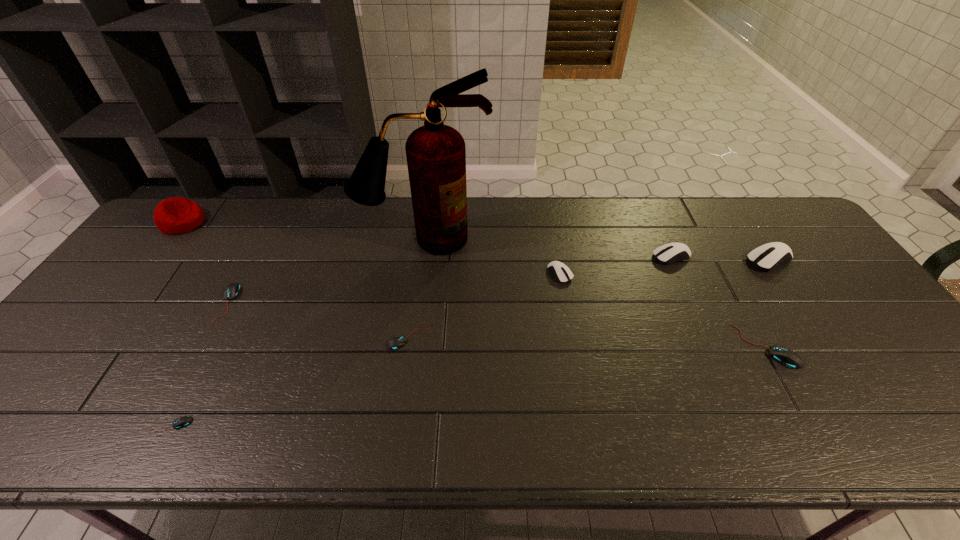
You are a GUI agent. You are given a task and a screenshot of the screen. Output one action in this format:
    pyautogui.click(x=<x>, y=<y>)
    Task: Click on the biggest black mouse
    Image resolution: width=960 pixels, height=540 pixels.
    Given the screenshot: What is the action you would take?
    pyautogui.click(x=785, y=356)

Locate an element on the screen. The width and height of the screenshot is (960, 540). the rightmost black mouse is located at coordinates [x=785, y=356].

This screenshot has height=540, width=960. Identify the location of the third shortest mouse. (232, 290).

Find the location of a particular element. The height and width of the screenshot is (540, 960). the second biggest black mouse is located at coordinates (232, 290).

In order to click on the fifth mouse from right to left in this screenshot , I will do `click(399, 340)`.

In order to click on the eighth tallest object in this screenshot , I will do `click(399, 340)`.

Where is `the nearest black mouse`? This screenshot has width=960, height=540. the nearest black mouse is located at coordinates (181, 422).

At what (x,y) coordinates should I click in order to perform the action: click on the nearest mouse. Please return your answer as a coordinate pair (x, y). Looking at the image, I should click on (181, 422).

Locate an element on the screen. The width and height of the screenshot is (960, 540). vacant space located at the nozzle of the tallest object is located at coordinates (412, 326).

Identify the location of vacant space located 0.360m on the seat area of the leftmost object. The image size is (960, 540). (313, 222).